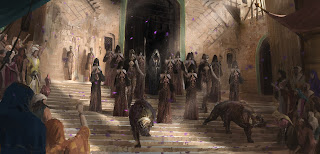
Where is `top step`? top step is located at coordinates (80, 83).